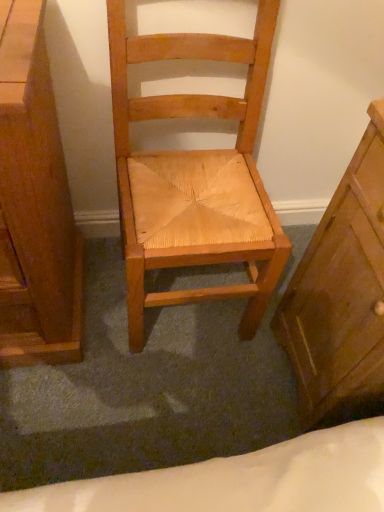
What do you see at coordinates (341, 290) in the screenshot? This screenshot has width=384, height=512. I see `wooden chest of drawers at right, which is the 1th chest of drawers from right to left` at bounding box center [341, 290].

What do you see at coordinates (34, 204) in the screenshot? I see `wooden chest of drawers at left, marked as the 2th chest of drawers in a right-to-left arrangement` at bounding box center [34, 204].

The height and width of the screenshot is (512, 384). What are the coordinates of `natural wood chair at center` in the screenshot? It's located at (194, 175).

The height and width of the screenshot is (512, 384). Find the location of `wooden chest of drawers at right, the second chest of drawers when ordered from left to right`. wooden chest of drawers at right, the second chest of drawers when ordered from left to right is located at coordinates (341, 290).

Between natural wood chair at center and wooden chest of drawers at left, which is the 1th chest of drawers from left to right, which one appears on the left side from the viewer's perspective?

Positioned to the left is wooden chest of drawers at left, which is the 1th chest of drawers from left to right.

Is natural wood chair at center spatially inside wooden chest of drawers at left, marked as the 2th chest of drawers in a right-to-left arrangement, or outside of it?

natural wood chair at center is not enclosed by wooden chest of drawers at left, marked as the 2th chest of drawers in a right-to-left arrangement.

At what (x,y) coordinates should I click in order to perform the action: click on chair on the right of wooden chest of drawers at left, which is the 1th chest of drawers from left to right. Please return your answer as a coordinate pair (x, y). This screenshot has width=384, height=512. Looking at the image, I should click on (194, 175).

Is natural wood chair at center facing away from wooden chest of drawers at left, marked as the 2th chest of drawers in a right-to-left arrangement?

That's not correct — natural wood chair at center is not looking away from wooden chest of drawers at left, marked as the 2th chest of drawers in a right-to-left arrangement.

Between wooden chest of drawers at left, which is the 1th chest of drawers from left to right, and wooden chest of drawers at right, which is the 1th chest of drawers from right to left, which one has larger width?

wooden chest of drawers at left, which is the 1th chest of drawers from left to right, is wider.

Based on the photo, is wooden chest of drawers at left, which is the 1th chest of drawers from left to right, not inside wooden chest of drawers at right, the second chest of drawers when ordered from left to right?

Yes, wooden chest of drawers at left, which is the 1th chest of drawers from left to right, is not within wooden chest of drawers at right, the second chest of drawers when ordered from left to right.

Can you confirm if wooden chest of drawers at left, which is the 1th chest of drawers from left to right, is bigger than wooden chest of drawers at right, which is the 1th chest of drawers from right to left?

Correct, wooden chest of drawers at left, which is the 1th chest of drawers from left to right, is larger in size than wooden chest of drawers at right, which is the 1th chest of drawers from right to left.

Is natural wood chair at center aimed at wooden chest of drawers at right, which is the 1th chest of drawers from right to left?

No.

This screenshot has height=512, width=384. Find the location of `the 2nd chest of drawers positioned below the natural wood chair at center (from the image's perspective)`. the 2nd chest of drawers positioned below the natural wood chair at center (from the image's perspective) is located at coordinates point(341,290).

Can you confirm if natural wood chair at center is bigger than wooden chest of drawers at right, the second chest of drawers when ordered from left to right?

Yes, natural wood chair at center is bigger than wooden chest of drawers at right, the second chest of drawers when ordered from left to right.

Do you think natural wood chair at center is within wooden chest of drawers at right, which is the 1th chest of drawers from right to left, or outside of it?

natural wood chair at center exists outside the volume of wooden chest of drawers at right, which is the 1th chest of drawers from right to left.

Can you tell me how much wooden chest of drawers at right, the second chest of drawers when ordered from left to right, and natural wood chair at center differ in facing direction?

The angular difference between wooden chest of drawers at right, the second chest of drawers when ordered from left to right, and natural wood chair at center is 89.6 degrees.

Is wooden chest of drawers at right, which is the 1th chest of drawers from right to left, far from natural wood chair at center?

They are positioned close to each other.

Which is behind, wooden chest of drawers at right, the second chest of drawers when ordered from left to right, or natural wood chair at center?

natural wood chair at center is further away from the camera.

Considering the relative sizes of wooden chest of drawers at right, which is the 1th chest of drawers from right to left, and natural wood chair at center in the image provided, is wooden chest of drawers at right, which is the 1th chest of drawers from right to left, wider than natural wood chair at center?

Incorrect, the width of wooden chest of drawers at right, which is the 1th chest of drawers from right to left, does not surpass that of natural wood chair at center.

Measure the distance between wooden chest of drawers at right, which is the 1th chest of drawers from right to left, and wooden chest of drawers at left, which is the 1th chest of drawers from left to right.

wooden chest of drawers at right, which is the 1th chest of drawers from right to left, is 25.12 inches away from wooden chest of drawers at left, which is the 1th chest of drawers from left to right.

Is wooden chest of drawers at right, which is the 1th chest of drawers from right to left, in contact with wooden chest of drawers at left, marked as the 2th chest of drawers in a right-to-left arrangement?

No, wooden chest of drawers at right, which is the 1th chest of drawers from right to left, is not in contact with wooden chest of drawers at left, marked as the 2th chest of drawers in a right-to-left arrangement.

From the picture: Is wooden chest of drawers at right, which is the 1th chest of drawers from right to left, completely or partially outside of wooden chest of drawers at left, marked as the 2th chest of drawers in a right-to-left arrangement?

Absolutely, wooden chest of drawers at right, which is the 1th chest of drawers from right to left, is external to wooden chest of drawers at left, marked as the 2th chest of drawers in a right-to-left arrangement.

From a real-world perspective, between wooden chest of drawers at right, the second chest of drawers when ordered from left to right, and wooden chest of drawers at left, marked as the 2th chest of drawers in a right-to-left arrangement, who is vertically higher?

From a 3D spatial view, wooden chest of drawers at left, marked as the 2th chest of drawers in a right-to-left arrangement, is above.

Between wooden chest of drawers at left, marked as the 2th chest of drawers in a right-to-left arrangement, and natural wood chair at center, which one has less height?

wooden chest of drawers at left, marked as the 2th chest of drawers in a right-to-left arrangement, is shorter.

From the picture: Which is behind, wooden chest of drawers at left, marked as the 2th chest of drawers in a right-to-left arrangement, or natural wood chair at center?

natural wood chair at center is further away from the camera.

From a real-world perspective, which object rests below the other?

wooden chest of drawers at left, marked as the 2th chest of drawers in a right-to-left arrangement.

From the image's perspective, is wooden chest of drawers at left, which is the 1th chest of drawers from left to right, below natural wood chair at center?

Indeed, from the image's perspective, wooden chest of drawers at left, which is the 1th chest of drawers from left to right, is shown beneath natural wood chair at center.

At what (x,y) coordinates should I click in order to perform the action: click on chair above the wooden chest of drawers at left, marked as the 2th chest of drawers in a right-to-left arrangement (from the image's perspective). Please return your answer as a coordinate pair (x, y). Looking at the image, I should click on (194, 175).

Find the location of a particular element. This screenshot has height=512, width=384. the chest of drawers beneath the wooden chest of drawers at left, marked as the 2th chest of drawers in a right-to-left arrangement (from a real-world perspective) is located at coordinates (341, 290).

When comparing their distances from wooden chest of drawers at left, which is the 1th chest of drawers from left to right, does wooden chest of drawers at right, the second chest of drawers when ordered from left to right, or natural wood chair at center seem further?

The object further to wooden chest of drawers at left, which is the 1th chest of drawers from left to right, is wooden chest of drawers at right, the second chest of drawers when ordered from left to right.

Estimate the real-world distances between objects in this image. Which object is closer to natural wood chair at center, wooden chest of drawers at right, the second chest of drawers when ordered from left to right, or wooden chest of drawers at left, which is the 1th chest of drawers from left to right?

Based on the image, wooden chest of drawers at right, the second chest of drawers when ordered from left to right, appears to be nearer to natural wood chair at center.

When comparing their distances from wooden chest of drawers at right, which is the 1th chest of drawers from right to left, does natural wood chair at center or wooden chest of drawers at left, marked as the 2th chest of drawers in a right-to-left arrangement, seem further?

Based on the image, wooden chest of drawers at left, marked as the 2th chest of drawers in a right-to-left arrangement, appears to be further to wooden chest of drawers at right, which is the 1th chest of drawers from right to left.

Estimate the real-world distances between objects in this image. Which object is further from wooden chest of drawers at right, the second chest of drawers when ordered from left to right, wooden chest of drawers at left, which is the 1th chest of drawers from left to right, or natural wood chair at center?

wooden chest of drawers at left, which is the 1th chest of drawers from left to right, lies further to wooden chest of drawers at right, the second chest of drawers when ordered from left to right, than the other object.

Looking at the image, which one is located further to natural wood chair at center, wooden chest of drawers at left, marked as the 2th chest of drawers in a right-to-left arrangement, or wooden chest of drawers at right, the second chest of drawers when ordered from left to right?

wooden chest of drawers at left, marked as the 2th chest of drawers in a right-to-left arrangement.

Looking at this image, which object lies nearer to the anchor point wooden chest of drawers at left, which is the 1th chest of drawers from left to right, natural wood chair at center or wooden chest of drawers at right, which is the 1th chest of drawers from right to left?

Among the two, natural wood chair at center is located nearer to wooden chest of drawers at left, which is the 1th chest of drawers from left to right.

This screenshot has height=512, width=384. What are the coordinates of `chair between wooden chest of drawers at left, marked as the 2th chest of drawers in a right-to-left arrangement, and wooden chest of drawers at right, the second chest of drawers when ordered from left to right` in the screenshot? It's located at (194, 175).